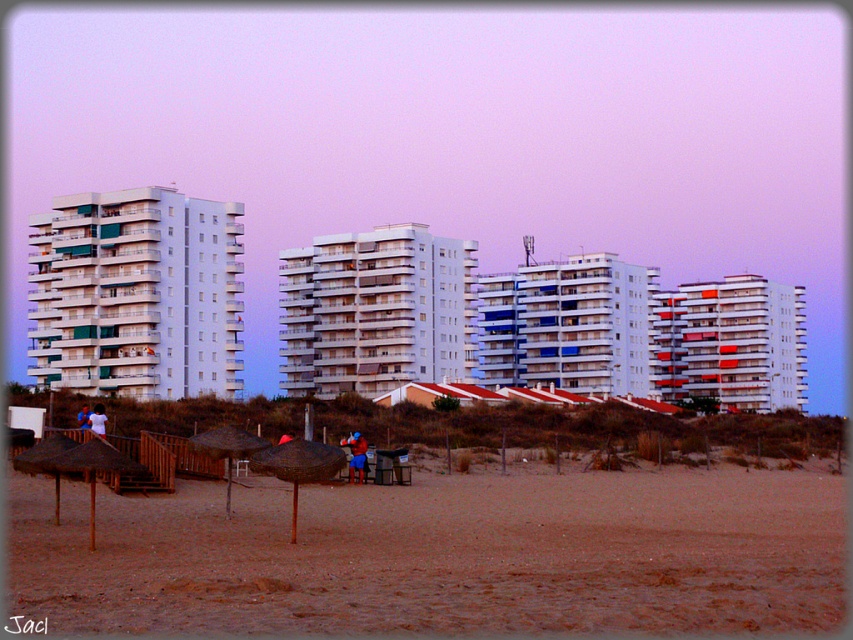
Question: Can you confirm if brown sandy beach at lower center is wider than blue fabric person at center?

Choices:
 (A) yes
 (B) no

Answer: (A)

Question: Which object is the farthest from the white fabric shirt at center?

Choices:
 (A) brown sandy beach at lower center
 (B) blue fabric person at center
 (C) blue fabric umbrella at lower left

Answer: (B)

Question: Which of the following is the closest to the observer?

Choices:
 (A) brown sandy beach at lower center
 (B) blue fabric person at center
 (C) white fabric shirt at center
 (D) blue fabric umbrella at lower left

Answer: (A)

Question: Is brown sandy beach at lower center further to the viewer compared to blue fabric umbrella at lower left?

Choices:
 (A) no
 (B) yes

Answer: (A)

Question: Which point is closer to the camera taking this photo?

Choices:
 (A) (358, 454)
 (B) (85, 428)

Answer: (B)

Question: Does brown sandy beach at lower center have a lesser width compared to white fabric shirt at center?

Choices:
 (A) no
 (B) yes

Answer: (A)